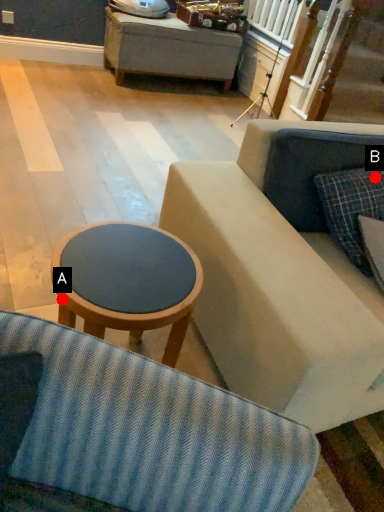
Question: Two points are circled on the image, labeled by A and B beside each circle. Which point is closer to the camera taking this photo?

Choices:
 (A) A is closer
 (B) B is closer

Answer: (A)